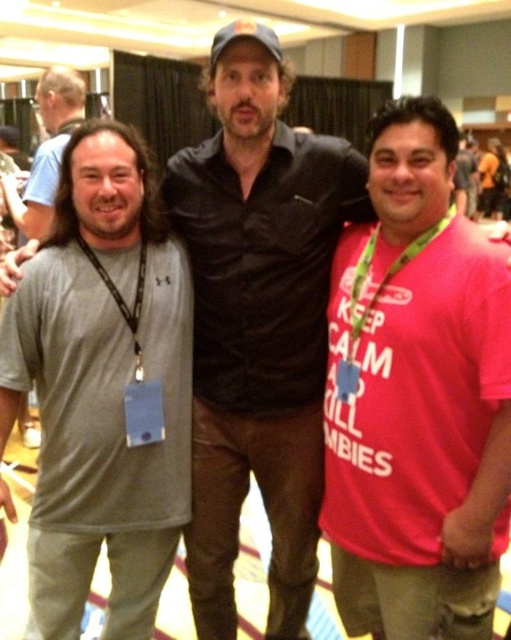
Is gray fabric shirt at left smaller than green fabric lanyard at center?

Incorrect, gray fabric shirt at left is not smaller in size than green fabric lanyard at center.

Between gray fabric shirt at left and green fabric lanyard at center, which one appears on the left side from the viewer's perspective?

Positioned to the left is gray fabric shirt at left.

Where is `gray fabric shirt at left`? The height and width of the screenshot is (640, 511). gray fabric shirt at left is located at coordinates (102, 387).

Which is behind, point (360, 225) or point (66, 68)?

The point (66, 68) is behind.

Between pink cotton t-shirt at right and gray cotton t-shirt at upper left, which one appears on the right side from the viewer's perspective?

pink cotton t-shirt at right is more to the right.

Locate an element on the screen. pink cotton t-shirt at right is located at coordinates (416, 396).

Is pink cotton t-shirt at right below green fabric lanyard at center?

Yes, pink cotton t-shirt at right is below green fabric lanyard at center.

Can you confirm if pink cotton t-shirt at right is wider than green fabric lanyard at center?

Indeed, pink cotton t-shirt at right has a greater width compared to green fabric lanyard at center.

What do you see at coordinates (416, 396) in the screenshot?
I see `pink cotton t-shirt at right` at bounding box center [416, 396].

Locate an element on the screen. pink cotton t-shirt at right is located at coordinates (416, 396).